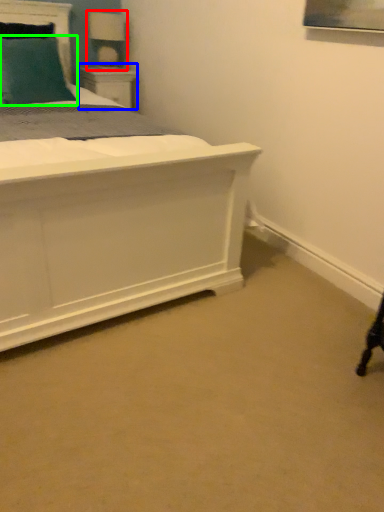
Question: Estimate the real-world distances between objects in this image. Which object is closer to table lamp (highlighted by a red box), nightstand (highlighted by a blue box) or pillow (highlighted by a green box)?

Choices:
 (A) nightstand
 (B) pillow

Answer: (A)